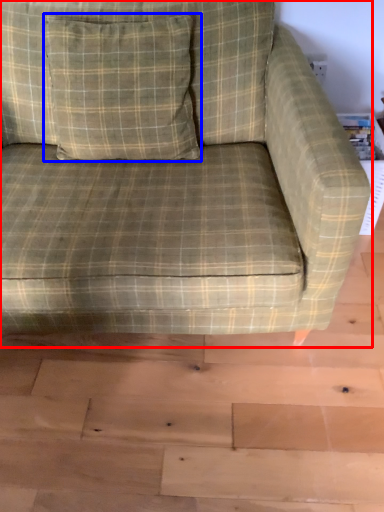
Question: Which object is closer to the camera taking this photo, studio couch (highlighted by a red box) or throw pillow (highlighted by a blue box)?

Choices:
 (A) studio couch
 (B) throw pillow

Answer: (A)